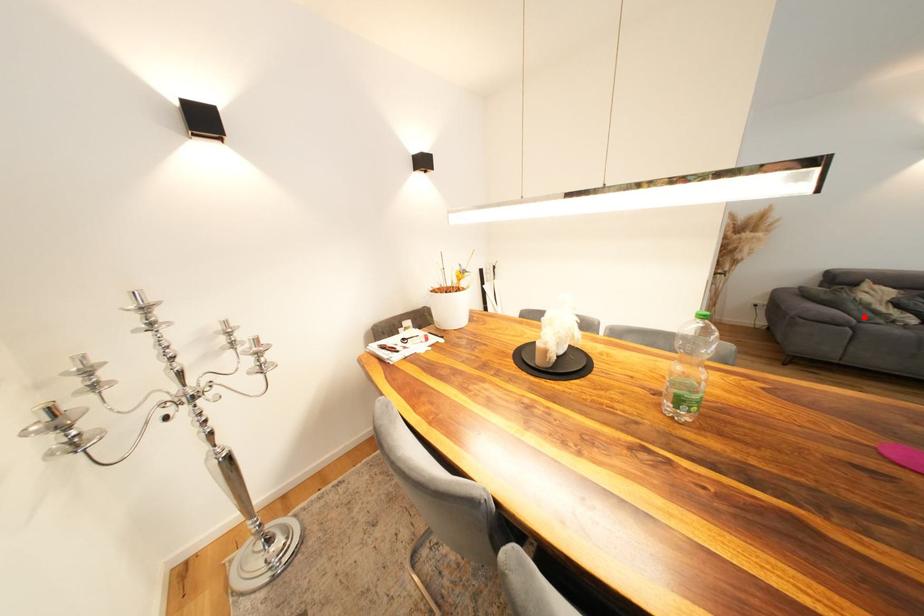
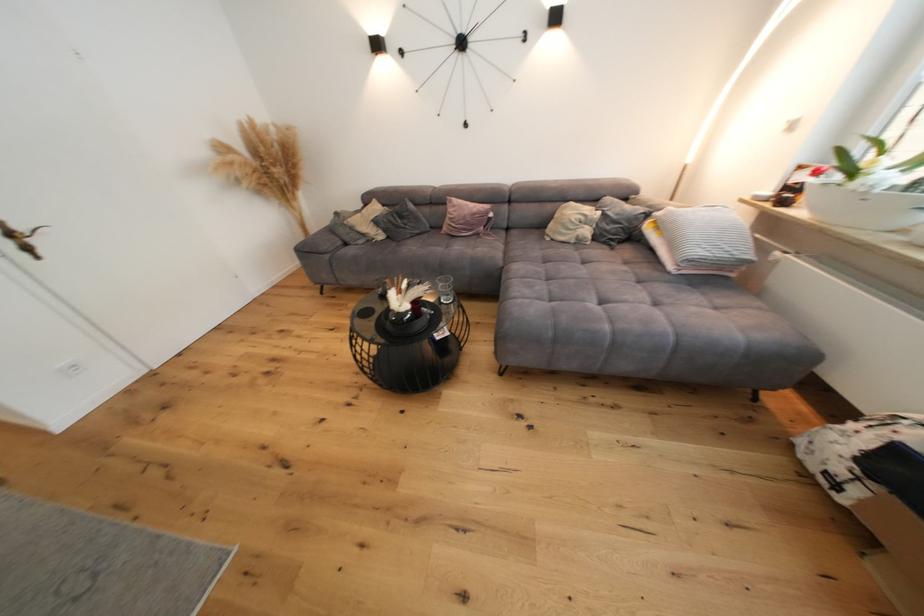
Locate, in the second image, the point that corresponds to the highlighted location in the first image.

(354, 240)